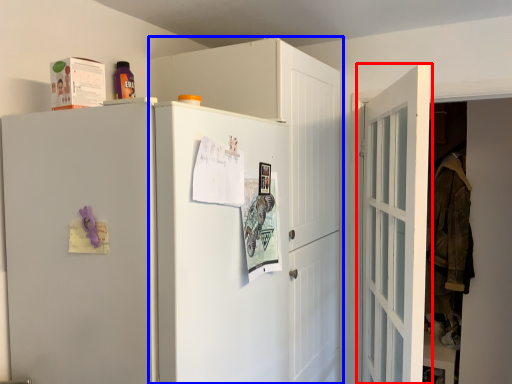
Question: Which point is further to the camera, door (highlighted by a red box) or cabinetry (highlighted by a blue box)?

Choices:
 (A) door
 (B) cabinetry

Answer: (B)